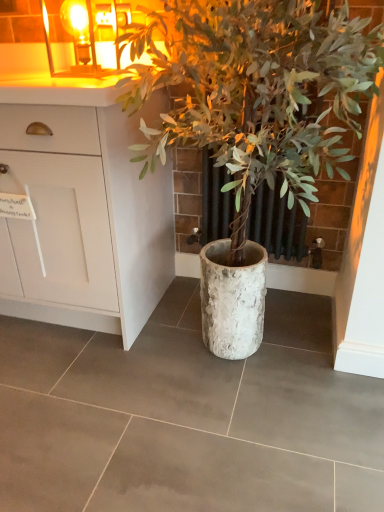
This screenshot has width=384, height=512. Describe the element at coordinates (256, 91) in the screenshot. I see `white textured pot at center` at that location.

Locate an element on the screen. amber glass candle at upper left is located at coordinates (79, 40).

Is the position of amber glass candle at upper left less distant than that of white matte cabinet at upper left?

No, amber glass candle at upper left is further to the viewer.

Would you say amber glass candle at upper left contains white matte cabinet at upper left?

That's incorrect, white matte cabinet at upper left is not inside amber glass candle at upper left.

Could you tell me if amber glass candle at upper left is turned towards white matte cabinet at upper left?

No, amber glass candle at upper left is not oriented towards white matte cabinet at upper left.

Does point (111, 254) lie behind point (310, 54)?

Yes, it is behind point (310, 54).

How much distance is there between white matte cabinet at upper left and white textured pot at center?

A distance of 40.54 centimeters exists between white matte cabinet at upper left and white textured pot at center.

Considering the relative sizes of white matte cabinet at upper left and white textured pot at center in the image provided, is white matte cabinet at upper left bigger than white textured pot at center?

Actually, white matte cabinet at upper left might be smaller than white textured pot at center.

Is white matte cabinet at upper left turned away from white textured pot at center?

No, white textured pot at center is not at the back of white matte cabinet at upper left.

Is white textured pot at center closer to the viewer compared to white matte cabinet at upper left?

Yes, it is.

Is white textured pot at center far away from white matte cabinet at upper left?

No, white textured pot at center is not far from white matte cabinet at upper left.

Based on the photo, considering the positions of objects white textured pot at center and white matte cabinet at upper left in the image provided, who is more to the right, white textured pot at center or white matte cabinet at upper left?

white textured pot at center.

Could you tell me if white textured pot at center is turned towards white matte cabinet at upper left?

No, white textured pot at center does not turn towards white matte cabinet at upper left.

Locate an element on the screen. houseplant on the right of the amber glass candle at upper left is located at coordinates (256, 91).

Is amber glass candle at upper left looking in the opposite direction of white textured pot at center?

No, white textured pot at center is not at the back of amber glass candle at upper left.

Which object is more forward, amber glass candle at upper left or white textured pot at center?

Positioned in front is white textured pot at center.

Based on their sizes in the image, would you say white matte cabinet at upper left is bigger or smaller than amber glass candle at upper left?

In the image, white matte cabinet at upper left appears to be larger than amber glass candle at upper left.

Is white matte cabinet at upper left facing towards amber glass candle at upper left?

No, white matte cabinet at upper left is not facing towards amber glass candle at upper left.

From the image's perspective, does white matte cabinet at upper left appear lower than amber glass candle at upper left?

Indeed, from the image's perspective, white matte cabinet at upper left is shown beneath amber glass candle at upper left.

Can you confirm if white textured pot at center is wider than amber glass candle at upper left?

Yes.

Which object is closer to the camera, white textured pot at center or amber glass candle at upper left?

Positioned in front is white textured pot at center.

Considering the relative sizes of white textured pot at center and amber glass candle at upper left in the image provided, is white textured pot at center bigger than amber glass candle at upper left?

Yes.

From a real-world perspective, is white textured pot at center located beneath amber glass candle at upper left?

Correct, in the physical world, white textured pot at center is lower than amber glass candle at upper left.

Where is `cabinetry lying in front of the amber glass candle at upper left`? The height and width of the screenshot is (512, 384). cabinetry lying in front of the amber glass candle at upper left is located at coordinates (84, 217).

In order to click on cabinetry that is above the white textured pot at center (from the image's perspective) in this screenshot , I will do `click(84, 217)`.

Estimate the real-world distances between objects in this image. Which object is closer to white textured pot at center, amber glass candle at upper left or white matte cabinet at upper left?

white matte cabinet at upper left lies closer to white textured pot at center than the other object.

Estimate the real-world distances between objects in this image. Which object is further from white matte cabinet at upper left, amber glass candle at upper left or white textured pot at center?

amber glass candle at upper left is further to white matte cabinet at upper left.

Looking at the image, which one is located closer to white matte cabinet at upper left, white textured pot at center or amber glass candle at upper left?

The object closer to white matte cabinet at upper left is white textured pot at center.

Looking at this image, looking at the image, which one is located further to white textured pot at center, white matte cabinet at upper left or amber glass candle at upper left?

amber glass candle at upper left.

Which object lies further to the anchor point amber glass candle at upper left, white textured pot at center or white matte cabinet at upper left?

white textured pot at center.

Considering their positions, is white matte cabinet at upper left positioned closer to amber glass candle at upper left than white textured pot at center?

The object closer to amber glass candle at upper left is white matte cabinet at upper left.

Image resolution: width=384 pixels, height=512 pixels. What are the coordinates of `light fixture between white matte cabinet at upper left and white textured pot at center from left to right` in the screenshot? It's located at (79, 40).